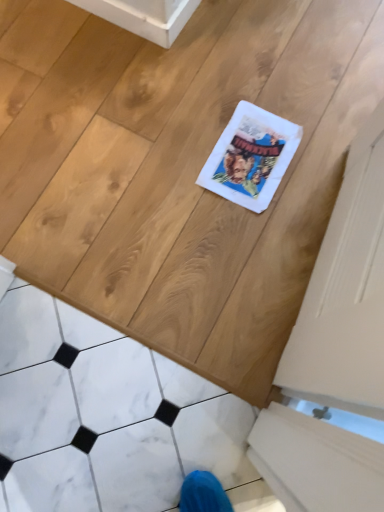
Identify the location of free point behind white matte screen door at right. (279, 124).